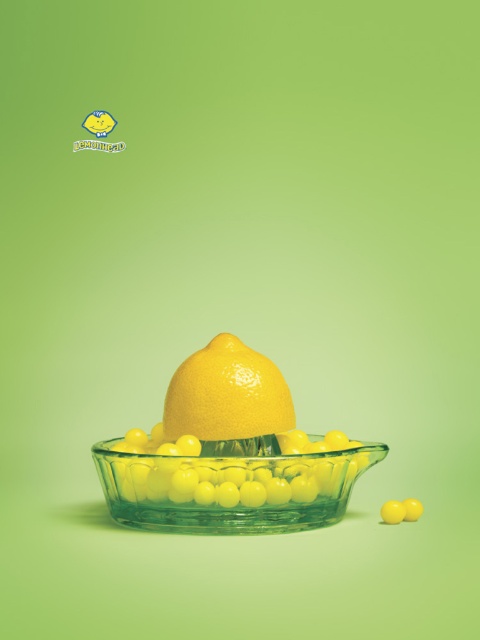
Question: Is transparent glass bowl at center closer to the viewer compared to glossy citrus fruit at center?

Choices:
 (A) yes
 (B) no

Answer: (A)

Question: Does transparent glass bowl at center have a lesser width compared to glossy citrus fruit at center?

Choices:
 (A) yes
 (B) no

Answer: (B)

Question: Is transparent glass bowl at center bigger than glossy citrus fruit at center?

Choices:
 (A) no
 (B) yes

Answer: (B)